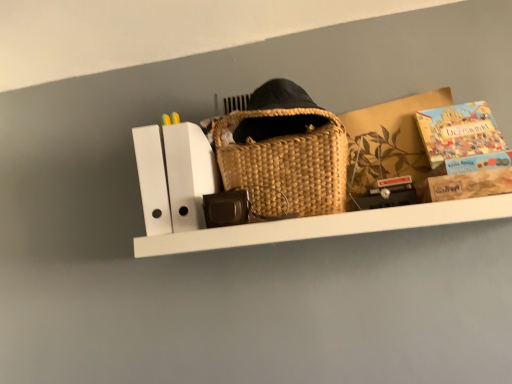
The image size is (512, 384). Find the location of `blank space situated above brown cardboard box at upper right (from a real-world perspective)`. blank space situated above brown cardboard box at upper right (from a real-world perspective) is located at coordinates (390, 99).